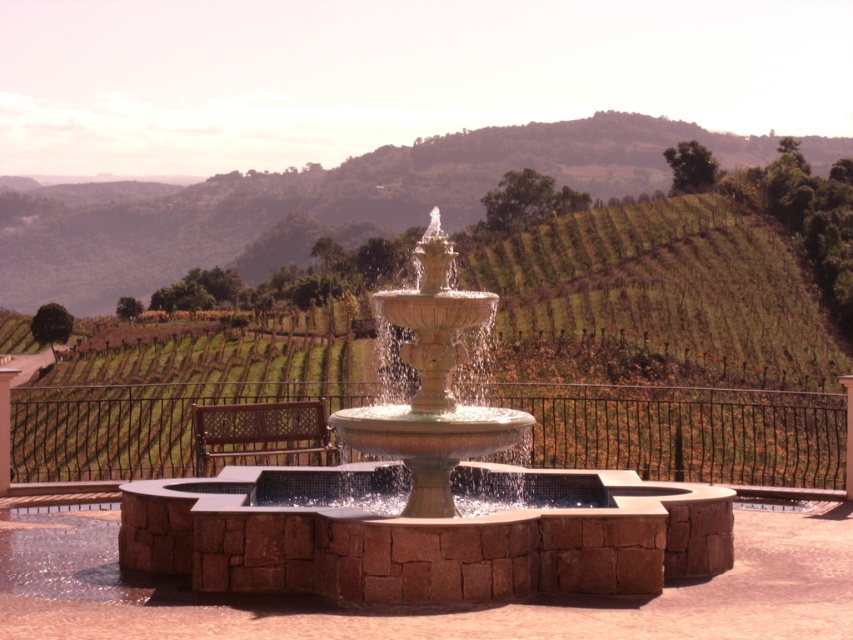
Question: Estimate the real-world distances between objects in this image. Which object is farther from the beige stone fountain at center?

Choices:
 (A) stone fountain at center
 (B) green grassy hillside at upper center

Answer: (B)

Question: Which object is positioned farthest from the beige stone fountain at center?

Choices:
 (A) stone fountain at center
 (B) green grassy hillside at upper center

Answer: (B)

Question: Can you confirm if green grassy hillside at upper center is wider than beige stone fountain at center?

Choices:
 (A) no
 (B) yes

Answer: (B)

Question: Can you confirm if stone fountain at center is wider than beige stone fountain at center?

Choices:
 (A) no
 (B) yes

Answer: (B)

Question: Which object is the farthest from the stone fountain at center?

Choices:
 (A) beige stone fountain at center
 (B) green grassy hillside at upper center

Answer: (B)

Question: Is green grassy hillside at upper center smaller than beige stone fountain at center?

Choices:
 (A) yes
 (B) no

Answer: (B)